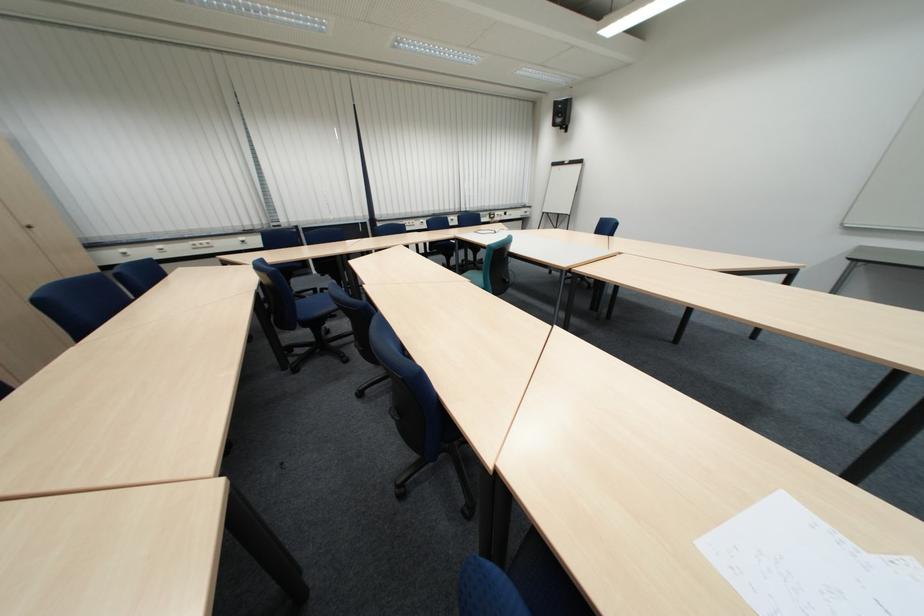
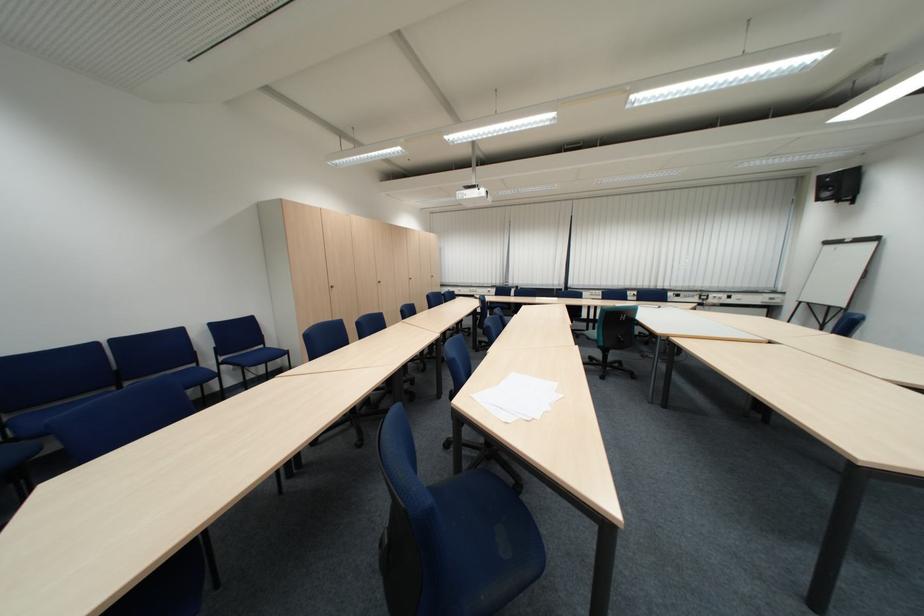
Locate, in the second image, the point that corresponds to [363,216] in the first image.

(564, 284)